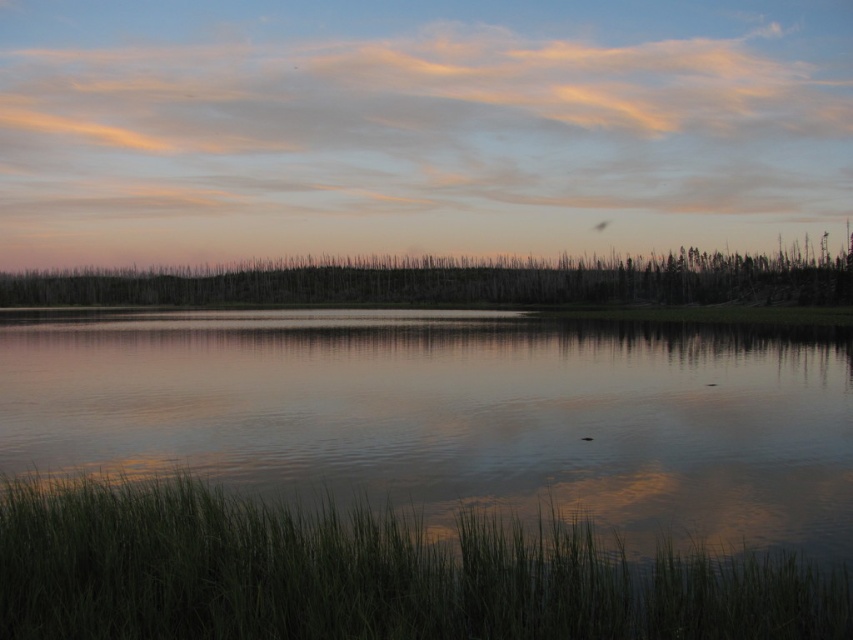
You are standing on a path that leads to the lake. You see the transparent water at center and the pastel cotton clouds at upper center. Which object is positioned to the right of the other?

The transparent water at center is positioned to the right of the pastel cotton clouds at upper center.

You are standing at the edge of the water and want to take a photo of the silhouetted dead trees at center and the pastel cotton clouds at upper center. If you need to ensure both are in focus, what should you consider about their distance?

The distance between the silhouetted dead trees at center and the pastel cotton clouds at upper center is 302.25 feet. To capture both in focus, you need a small aperture setting to increase the depth of field, as they are quite far apart.